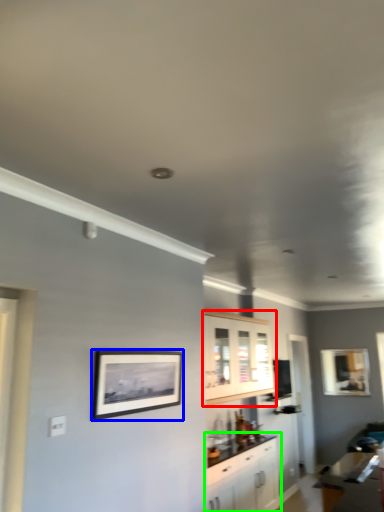
Question: Which object is the closest to the cabinetry (highlighted by a red box)? Choose among these: picture frame (highlighted by a blue box) or cabinetry (highlighted by a green box).

Choices:
 (A) picture frame
 (B) cabinetry

Answer: (B)